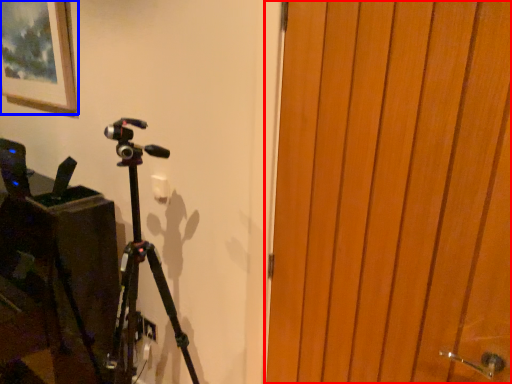
Question: Which point is closer to the camera, door (highlighted by a red box) or picture frame (highlighted by a blue box)?

Choices:
 (A) door
 (B) picture frame

Answer: (A)